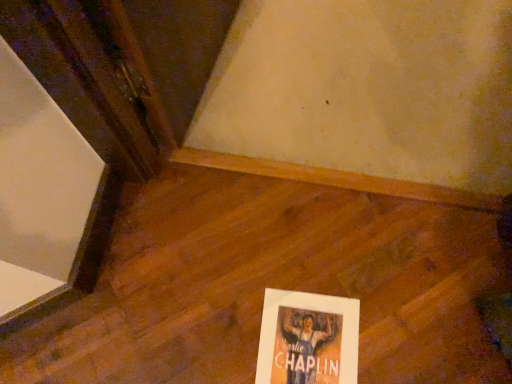
Question: Is wooden floor at center oriented away from matte paper poster at lower right?

Choices:
 (A) no
 (B) yes

Answer: (B)

Question: Is matte paper poster at lower right surrounded by wooden floor at center?

Choices:
 (A) yes
 (B) no

Answer: (A)

Question: Is wooden floor at center to the left of matte paper poster at lower right from the viewer's perspective?

Choices:
 (A) yes
 (B) no

Answer: (A)

Question: Can you confirm if wooden floor at center is smaller than matte paper poster at lower right?

Choices:
 (A) yes
 (B) no

Answer: (B)

Question: Considering the relative sizes of wooden floor at center and matte paper poster at lower right in the image provided, is wooden floor at center thinner than matte paper poster at lower right?

Choices:
 (A) no
 (B) yes

Answer: (A)

Question: Considering the relative sizes of wooden floor at center and matte paper poster at lower right in the image provided, is wooden floor at center taller than matte paper poster at lower right?

Choices:
 (A) yes
 (B) no

Answer: (A)

Question: Is matte paper poster at lower right with wooden floor at center?

Choices:
 (A) yes
 (B) no

Answer: (B)

Question: Can you confirm if matte paper poster at lower right is positioned to the left of wooden floor at center?

Choices:
 (A) yes
 (B) no

Answer: (B)

Question: Is matte paper poster at lower right oriented towards wooden floor at center?

Choices:
 (A) no
 (B) yes

Answer: (B)

Question: Considering the relative sizes of matte paper poster at lower right and wooden floor at center in the image provided, is matte paper poster at lower right wider than wooden floor at center?

Choices:
 (A) no
 (B) yes

Answer: (A)

Question: Is matte paper poster at lower right outside wooden floor at center?

Choices:
 (A) yes
 (B) no

Answer: (B)

Question: From the image's perspective, is matte paper poster at lower right beneath wooden floor at center?

Choices:
 (A) yes
 (B) no

Answer: (A)

Question: Considering the positions of wooden floor at center and matte paper poster at lower right in the image, is wooden floor at center bigger or smaller than matte paper poster at lower right?

Choices:
 (A) small
 (B) big

Answer: (B)